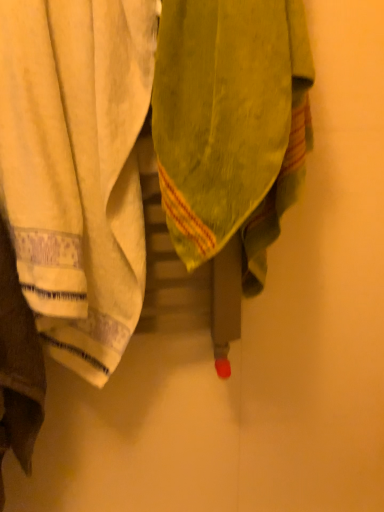
Question: Is green textured towel at center, acting as the 1th towel starting from the right, in front of or behind white cotton towel at left, which is counted as the 2th towel, starting from the right, in the image?

Choices:
 (A) front
 (B) behind

Answer: (A)

Question: From the image's perspective, relative to white cotton towel at left, which is counted as the 2th towel, starting from the right, is green textured towel at center, which ranks as the 2th towel in left-to-right order, above or below?

Choices:
 (A) above
 (B) below

Answer: (A)

Question: In terms of height, does green textured towel at center, which ranks as the 2th towel in left-to-right order, look taller or shorter compared to white cotton towel at left, which is counted as the 2th towel, starting from the right?

Choices:
 (A) short
 (B) tall

Answer: (A)

Question: Is white cotton towel at left, which is counted as the 2th towel, starting from the right, bigger or smaller than green textured towel at center, acting as the 1th towel starting from the right?

Choices:
 (A) small
 (B) big

Answer: (B)

Question: Is white cotton towel at left, which is counted as the 2th towel, starting from the right, taller or shorter than green textured towel at center, which ranks as the 2th towel in left-to-right order?

Choices:
 (A) tall
 (B) short

Answer: (A)

Question: From a real-world perspective, is white cotton towel at left, the first towel when ordered from left to right, above or below green textured towel at center, which ranks as the 2th towel in left-to-right order?

Choices:
 (A) below
 (B) above

Answer: (A)

Question: Does point (56, 67) appear closer or farther from the camera than point (235, 51)?

Choices:
 (A) closer
 (B) farther

Answer: (B)